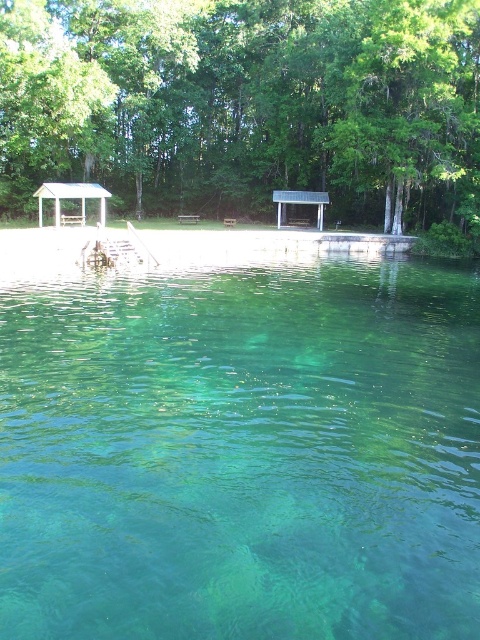
Can you confirm if green leafy tree at center is positioned to the right of wooden picnic table at center?

Indeed, green leafy tree at center is positioned on the right side of wooden picnic table at center.

Can you confirm if green leafy tree at center is shorter than wooden picnic table at center?

In fact, green leafy tree at center may be taller than wooden picnic table at center.

Which is in front, point (425, 156) or point (180, 218)?

Point (425, 156) is in front.

Find the location of a particular element. This screenshot has width=480, height=640. green leafy tree at center is located at coordinates (247, 106).

From the picture: Can you confirm if clear water at center is smaller than wooden dock at center?

No.

Who is higher up, clear water at center or wooden dock at center?

wooden dock at center is higher up.

Does point (300, 499) come farther from viewer compared to point (154, 262)?

No.

Locate an element on the screen. Image resolution: width=480 pixels, height=640 pixels. clear water at center is located at coordinates (241, 452).

Can you confirm if clear water at center is positioned to the left of green leafy tree at center?

In fact, clear water at center is to the right of green leafy tree at center.

Measure the distance between clear water at center and camera.

The distance of clear water at center from camera is 5.66 meters.

What do you see at coordinates (241, 452) in the screenshot?
I see `clear water at center` at bounding box center [241, 452].

Locate an element on the screen. This screenshot has height=640, width=480. clear water at center is located at coordinates (241, 452).